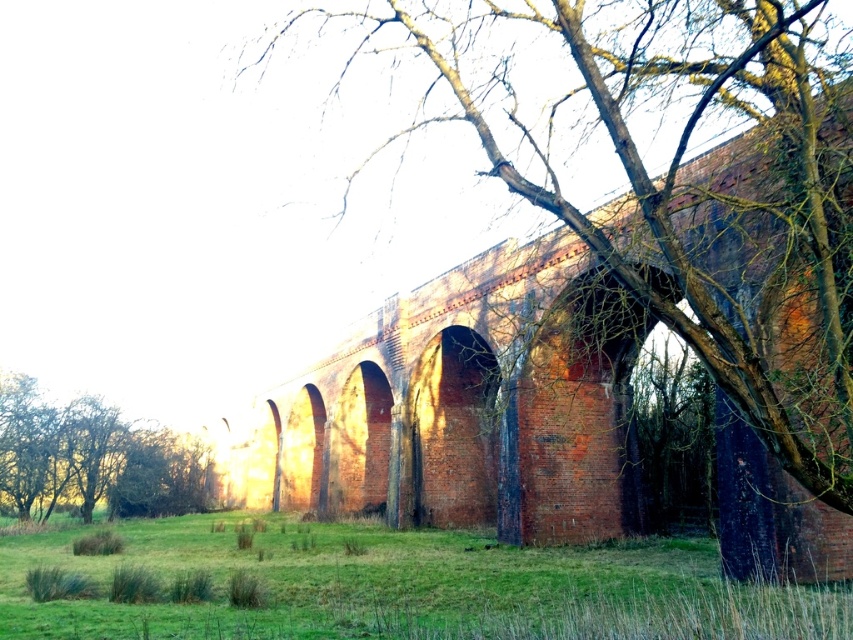
Which is below, brown textured tree at center or green leafy tree at lower left?

green leafy tree at lower left

Which is more to the right, brown textured tree at center or green leafy tree at lower left?

brown textured tree at center

Identify the location of brown textured tree at center. The width and height of the screenshot is (853, 640). (606, 296).

Locate an element on the screen. The image size is (853, 640). brown textured tree at center is located at coordinates (606, 296).

Who is more forward, (799,6) or (451,552)?

Point (799,6) is more forward.

Is point (821, 388) behind point (465, 620)?

No, (821, 388) is closer to viewer.

What are the coordinates of `brown textured tree at center` in the screenshot? It's located at tap(606, 296).

Can you confirm if green grassy at lower center is positioned above green leafy tree at lower left?

Indeed, green grassy at lower center is positioned over green leafy tree at lower left.

In the scene shown: Can you confirm if green grassy at lower center is positioned to the left of green leafy tree at lower left?

No, green grassy at lower center is not to the left of green leafy tree at lower left.

Is point (209, 532) less distant than point (138, 500)?

Yes, point (209, 532) is in front of point (138, 500).

Identify the location of green grassy at lower center. (399, 586).